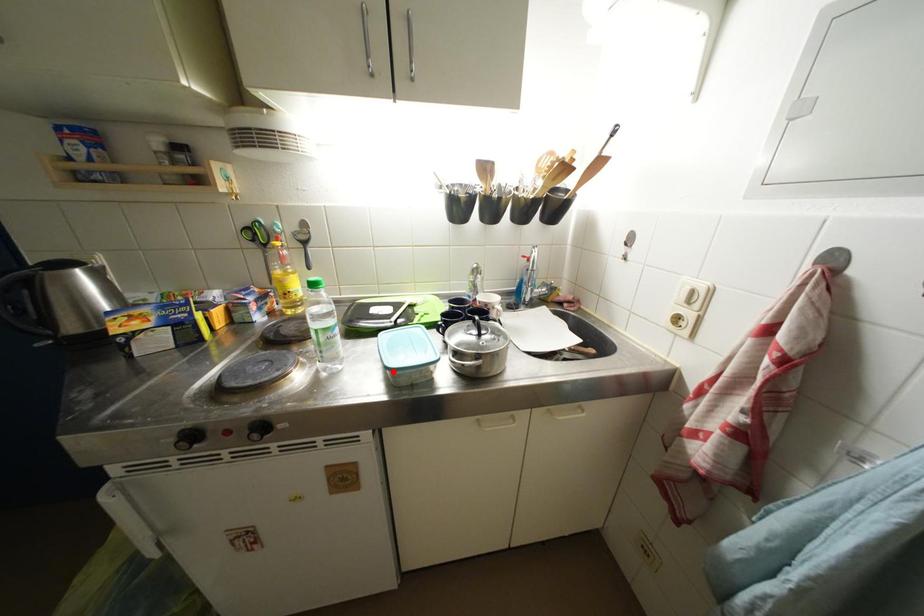
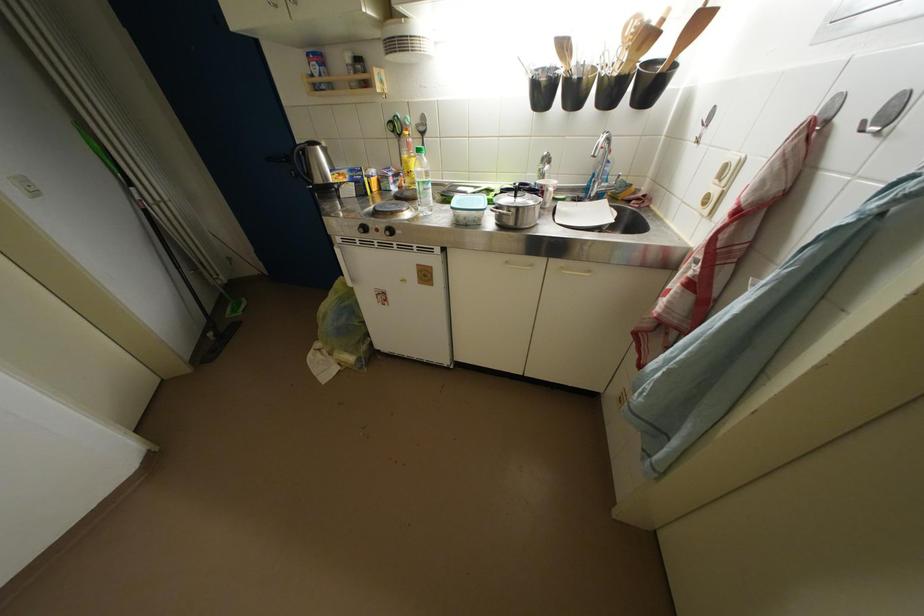
Question: I am providing you with two images of the same scene from different viewpoints. A red point is marked on the first image. Can you still see the location of the red point in image 2?

Choices:
 (A) Yes
 (B) No

Answer: (A)